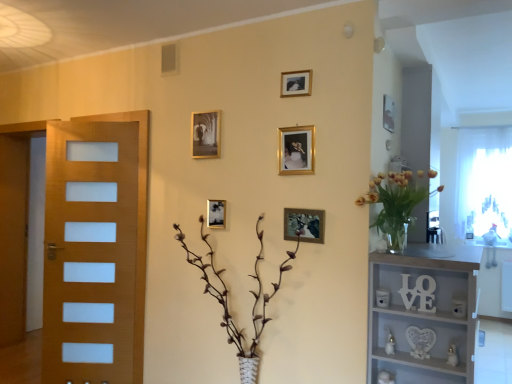
Question: Is point (241, 365) closer or farther from the camera than point (394, 109)?

Choices:
 (A) farther
 (B) closer

Answer: (B)

Question: Considering the positions of brown textured plant at center and gold metallic picture frame at upper center, arranged as the sixth picture frame when viewed from the left, in the image, is brown textured plant at center taller or shorter than gold metallic picture frame at upper center, arranged as the sixth picture frame when viewed from the left,?

Choices:
 (A) tall
 (B) short

Answer: (A)

Question: Estimate the real-world distances between objects in this image. Which object is farther from the brown textured plant at center?

Choices:
 (A) gold metallic picture frame at center, which appears as the second picture frame when viewed from the right
 (B) gold metallic picture frame at upper center, marked as the 4th picture frame in a left-to-right arrangement
 (C) white sheer curtain at right
 (D) white matte shelf at right
 (E) wooden door at left

Answer: (C)

Question: Considering the real-world distances, which object is closest to the wooden door at left?

Choices:
 (A) gold metallic picture frame at upper center, which is the 3th picture frame in right-to-left order
 (B) gold metallic picture frame at upper center, arranged as the sixth picture frame when viewed from the left
 (C) gold metallic picture frame at upper center, which is the sixth picture frame in right-to-left order
 (D) brown textured plant at center
 (E) white sheer curtain at right

Answer: (D)